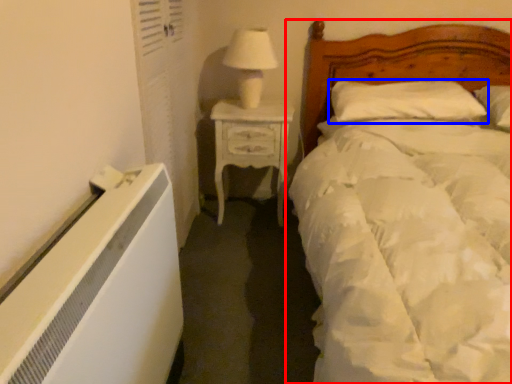
Question: Among these objects, which one is farthest to the camera, bed (highlighted by a red box) or pillow (highlighted by a blue box)?

Choices:
 (A) bed
 (B) pillow

Answer: (B)